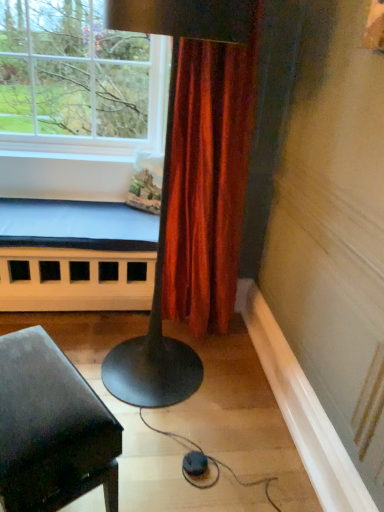
Where is `matte black piano at lower left`? This screenshot has height=512, width=384. matte black piano at lower left is located at coordinates (51, 429).

Describe the element at coordinates (79, 77) in the screenshot. I see `clear glass window at upper left` at that location.

The image size is (384, 512). Identify the location of matte black piano at lower left. (51, 429).

In the scene shown: Is matte black piano at lower left looking in the opposite direction of white painted wood bed frame at lower left?

No, matte black piano at lower left is not facing away from white painted wood bed frame at lower left.

From a real-world perspective, who is located lower, matte black piano at lower left or white painted wood bed frame at lower left?

From a 3D spatial view, matte black piano at lower left is below.

Considering the sizes of matte black piano at lower left and white painted wood bed frame at lower left in the image, is matte black piano at lower left bigger or smaller than white painted wood bed frame at lower left?

In the image, matte black piano at lower left appears to be smaller than white painted wood bed frame at lower left.

The height and width of the screenshot is (512, 384). I want to click on furniture located underneath the white painted wood bed frame at lower left (from a real-world perspective), so click(51, 429).

Is white painted wood bed frame at lower left aimed at matte black piano at lower left?

Yes, white painted wood bed frame at lower left faces towards matte black piano at lower left.

From a real-world perspective, is white painted wood bed frame at lower left over matte black piano at lower left?

Yes, from a real-world perspective, white painted wood bed frame at lower left is above matte black piano at lower left.

From the image's perspective, is white painted wood bed frame at lower left above or below matte black piano at lower left?

Clearly, from the image's perspective, white painted wood bed frame at lower left is above matte black piano at lower left.

Who is smaller, white painted wood bed frame at lower left or matte black piano at lower left?

Smaller between the two is matte black piano at lower left.

Is clear glass window at upper left further to camera compared to matte black piano at lower left?

Yes, it is behind matte black piano at lower left.

Considering the relative sizes of clear glass window at upper left and matte black piano at lower left in the image provided, is clear glass window at upper left smaller than matte black piano at lower left?

Incorrect, clear glass window at upper left is not smaller in size than matte black piano at lower left.

Measure the distance between clear glass window at upper left and matte black piano at lower left.

A distance of 2.01 meters exists between clear glass window at upper left and matte black piano at lower left.

Is clear glass window at upper left aimed at matte black piano at lower left?

Yes, clear glass window at upper left is turned towards matte black piano at lower left.

Considering the positions of points (85, 445) and (23, 32), is point (85, 445) farther from camera compared to point (23, 32)?

No, it is in front of (23, 32).

From the image's perspective, is matte black piano at lower left located above or below clear glass window at upper left?

matte black piano at lower left is below clear glass window at upper left.

Does matte black piano at lower left have a smaller size compared to clear glass window at upper left?

Yes.

I want to click on window above the matte black piano at lower left (from the image's perspective), so click(79, 77).

Does white painted wood bed frame at lower left touch clear glass window at upper left?

white painted wood bed frame at lower left and clear glass window at upper left are not in contact.

Based on their sizes in the image, would you say white painted wood bed frame at lower left is bigger or smaller than clear glass window at upper left?

In the image, white painted wood bed frame at lower left appears to be smaller than clear glass window at upper left.

Considering the relative sizes of white painted wood bed frame at lower left and clear glass window at upper left in the image provided, is white painted wood bed frame at lower left taller than clear glass window at upper left?

No.

In the scene shown: How many degrees apart are the facing directions of clear glass window at upper left and white painted wood bed frame at lower left?

The facing directions of clear glass window at upper left and white painted wood bed frame at lower left are 0.891 degrees apart.

Looking at this image, which of these two, clear glass window at upper left or white painted wood bed frame at lower left, is wider?

With larger width is clear glass window at upper left.

Is clear glass window at upper left placed right next to white painted wood bed frame at lower left?

No.

From a real-world perspective, is clear glass window at upper left located beneath white painted wood bed frame at lower left?

Actually, clear glass window at upper left is physically above white painted wood bed frame at lower left in the real world.

At what (x,y) coordinates should I click in order to perform the action: click on bed frame above the matte black piano at lower left (from the image's perspective). Please return your answer as a coordinate pair (x, y). The height and width of the screenshot is (512, 384). Looking at the image, I should click on (76, 256).

Find the location of a particular element. This screenshot has width=384, height=512. furniture that is below the white painted wood bed frame at lower left (from the image's perspective) is located at coordinates [51, 429].

Considering their positions, is matte black piano at lower left positioned closer to white painted wood bed frame at lower left than clear glass window at upper left?

clear glass window at upper left lies closer to white painted wood bed frame at lower left than the other object.

Estimate the real-world distances between objects in this image. Which object is further from matte black piano at lower left, clear glass window at upper left or white painted wood bed frame at lower left?

clear glass window at upper left is positioned further to the anchor matte black piano at lower left.

Estimate the real-world distances between objects in this image. Which object is further from matte black piano at lower left, white painted wood bed frame at lower left or clear glass window at upper left?

clear glass window at upper left is further to matte black piano at lower left.

From the image, which object appears to be nearer to clear glass window at upper left, white painted wood bed frame at lower left or matte black piano at lower left?

The object closer to clear glass window at upper left is white painted wood bed frame at lower left.

Which object lies nearer to the anchor point clear glass window at upper left, matte black piano at lower left or white painted wood bed frame at lower left?

white painted wood bed frame at lower left is positioned closer to the anchor clear glass window at upper left.

Considering their positions, is clear glass window at upper left positioned closer to white painted wood bed frame at lower left than matte black piano at lower left?

Based on the image, clear glass window at upper left appears to be nearer to white painted wood bed frame at lower left.

This screenshot has width=384, height=512. Identify the location of bed frame between clear glass window at upper left and matte black piano at lower left in the vertical direction. (76, 256).